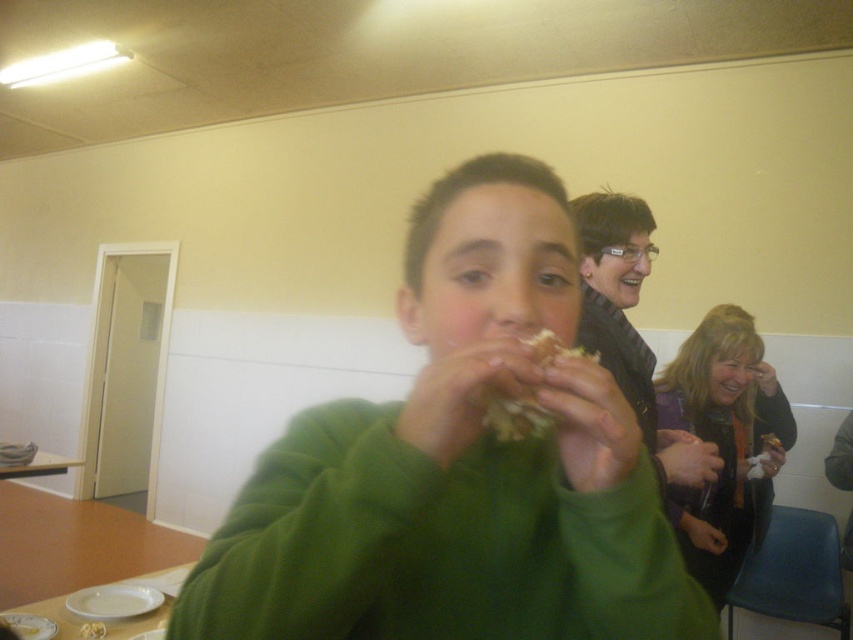
Question: Which object is positioned closest to the bread-like at center?

Choices:
 (A) matte purple jacket at lower right
 (B) wooden table at lower left
 (C) matte black jacket at upper right

Answer: (C)

Question: Does matte black jacket at upper right appear on the left side of white glossy plate at lower left?

Choices:
 (A) yes
 (B) no

Answer: (B)

Question: Which object appears farthest from the camera in this image?

Choices:
 (A) green matte sweater at center
 (B) bread-like at center
 (C) matte purple jacket at lower right
 (D) wooden table at lower left

Answer: (D)

Question: Can you confirm if green matte sweater at center is wider than bread-like at center?

Choices:
 (A) no
 (B) yes

Answer: (B)

Question: Can you confirm if white glossy plate at lower left is thinner than wooden table at lower left?

Choices:
 (A) no
 (B) yes

Answer: (A)

Question: Among these points, which one is farthest from the camera?

Choices:
 (A) (62, 630)
 (B) (643, 204)
 (C) (32, 468)

Answer: (C)